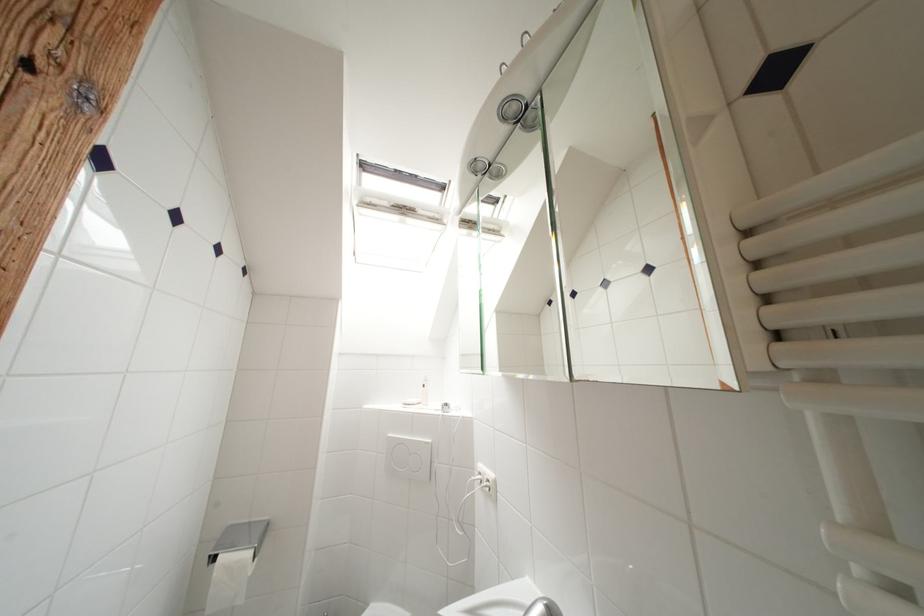
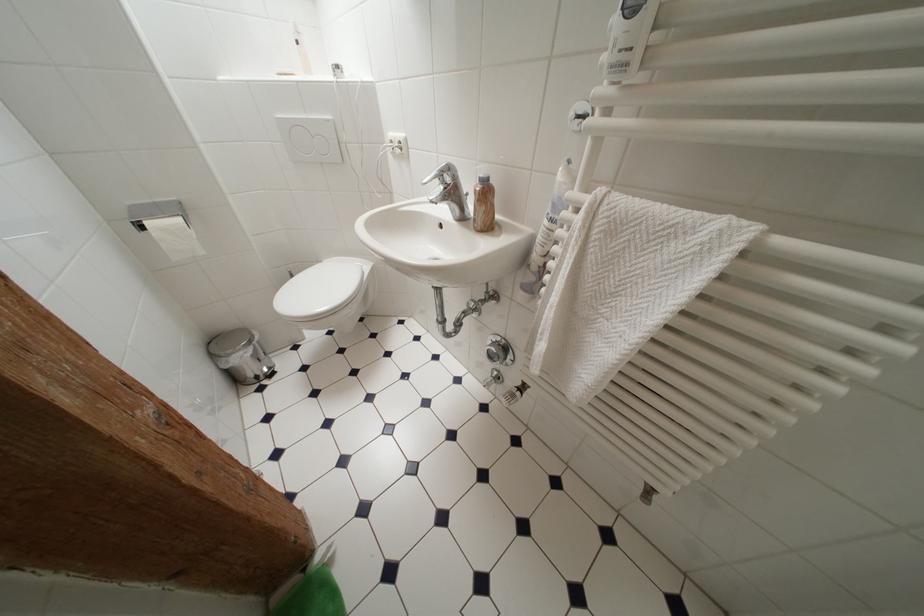
Where in the second image is the point corresponding to point (238, 549) from the first image?

(160, 219)